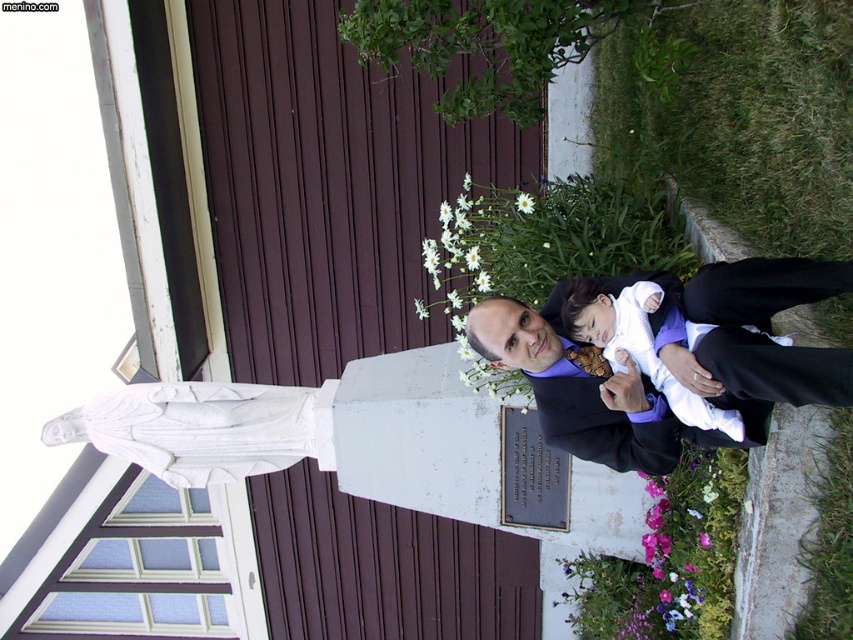
Describe the element at coordinates (708, 364) in the screenshot. Image resolution: width=853 pixels, height=640 pixels. I see `black satin suit at right` at that location.

Is black satin suit at right below white fabric baby at center?

Yes.

Find the location of `black satin suit at right`. black satin suit at right is located at coordinates (708, 364).